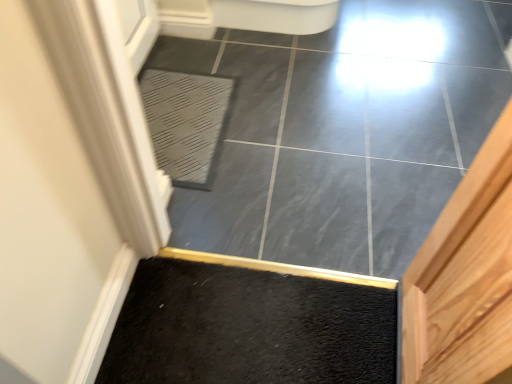
This screenshot has height=384, width=512. I want to click on free point below gray textured bath mat at center (from a real-world perspective), so click(167, 119).